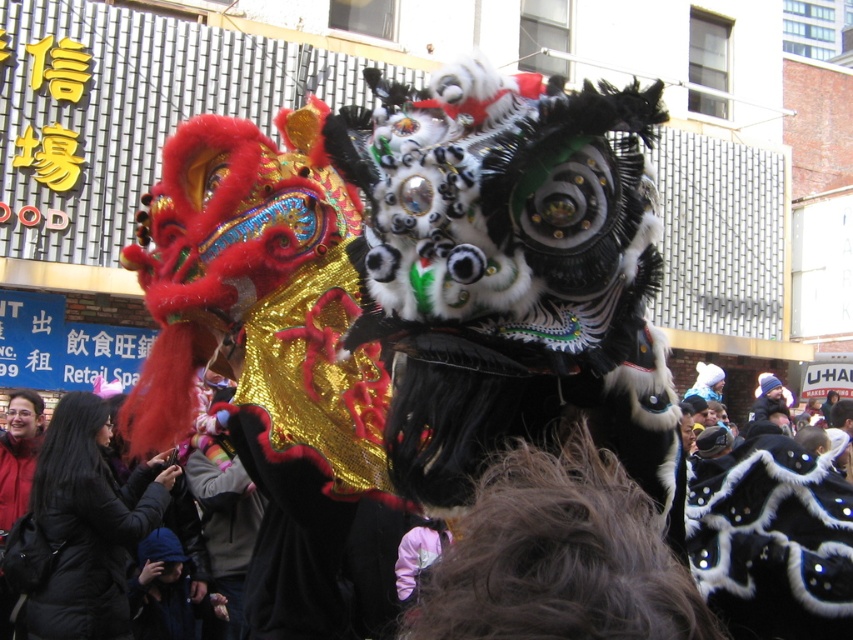
Question: Where is black sequined mask at center located in relation to velvet black coat at lower left in the image?

Choices:
 (A) below
 (B) above

Answer: (B)

Question: Among these points, which one is farthest from the camera?

Choices:
 (A) (119, 561)
 (B) (764, 582)

Answer: (A)

Question: Does black sequined mask at center appear on the left side of velvet black coat at lower left?

Choices:
 (A) no
 (B) yes

Answer: (A)

Question: Is black sequined mask at center to the right of velvet black coat at lower left from the viewer's perspective?

Choices:
 (A) yes
 (B) no

Answer: (A)

Question: Among these objects, which one is farthest from the camera?

Choices:
 (A) velvet black coat at lower left
 (B) black sequined mask at center

Answer: (A)